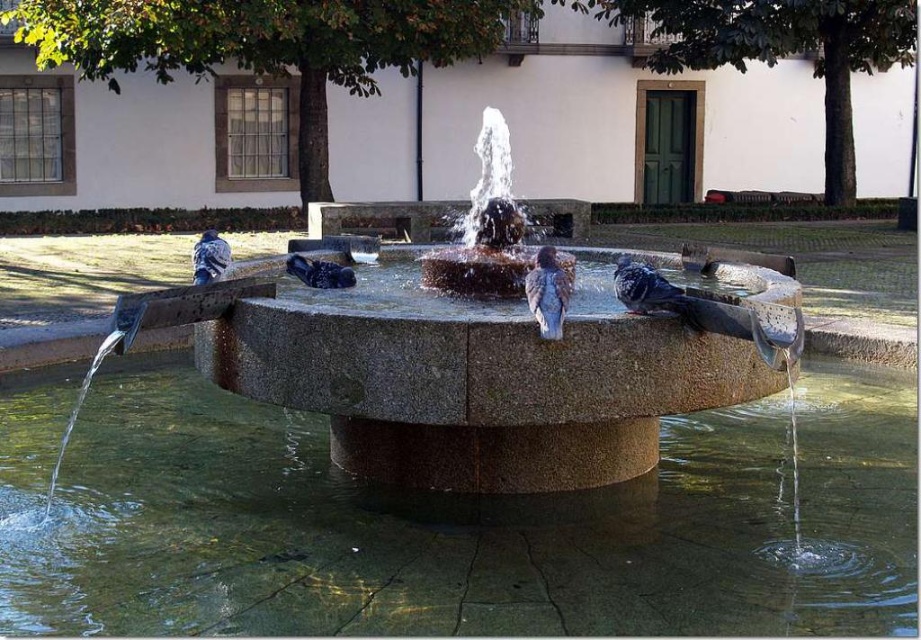
You are a photographer aiming to capture a closeup of both the brown speckled feathers at center and the matte black pigeon at center. Which object should you focus on first to ensure both are in focus?

You should focus on the brown speckled feathers at center first since it is closer to the viewer than the matte black pigeon at center. By focusing on the closer object, the matte black pigeon at center will be within the depth of field, ensuring both are in focus.